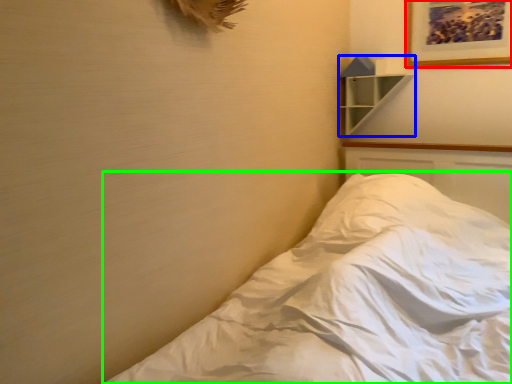
Question: Estimate the real-world distances between objects in this image. Which object is closer to picture frame (highlighted by a red box), shelf (highlighted by a blue box) or bed (highlighted by a green box)?

Choices:
 (A) shelf
 (B) bed

Answer: (A)